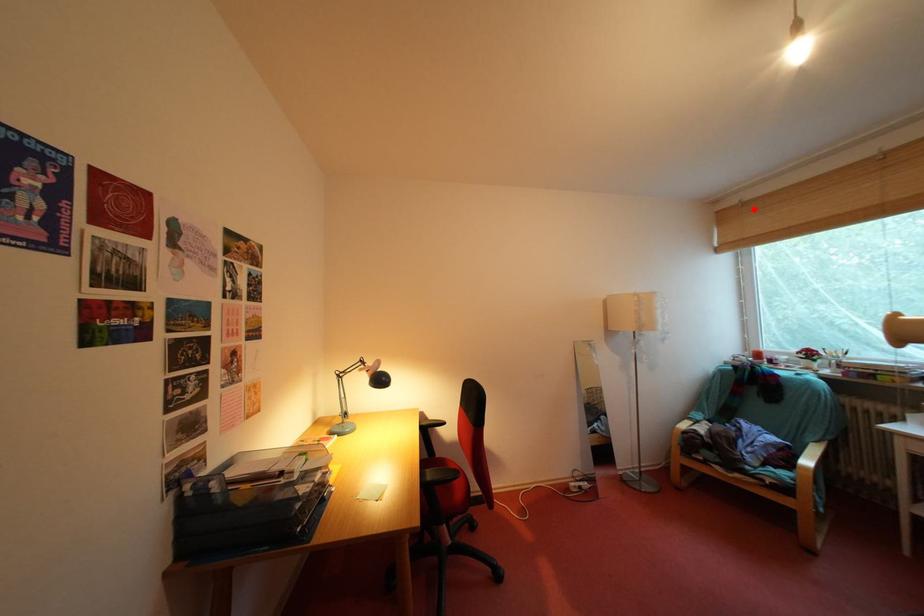
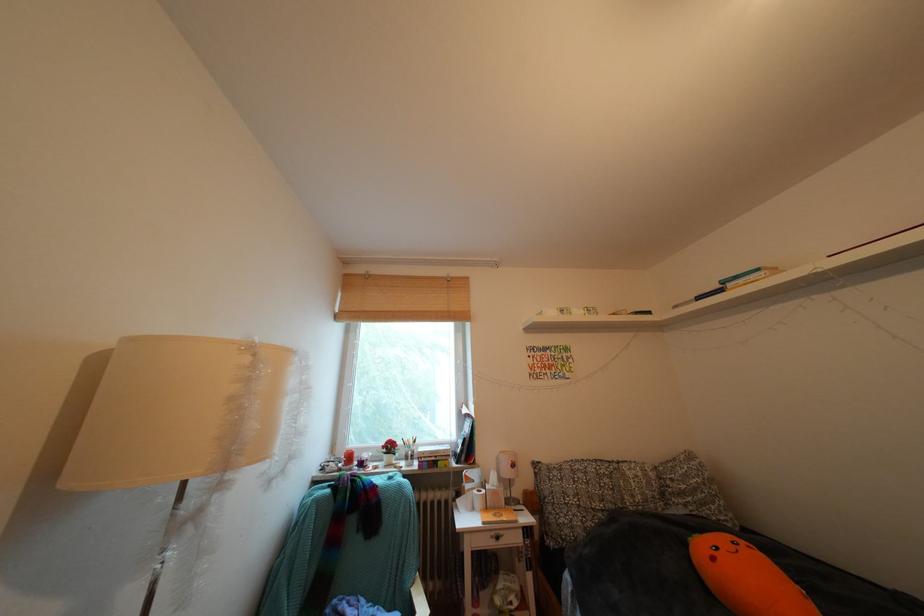
The point at the highlighted location is marked in the first image. Where is the corresponding point in the second image?

(379, 282)